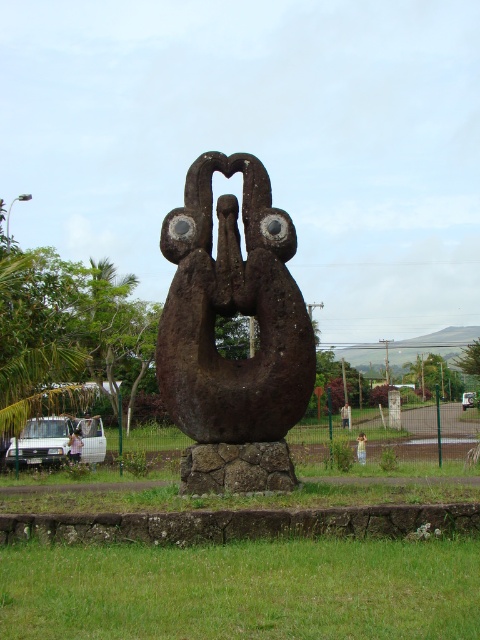
You are standing in front of the stone sculpture and want to place a small object on the ground near the white fabric at lower left. Based on the coordinates provided, where should you aim to place it?

The white fabric at lower left is located at coordinates point (75, 445), so you should aim to place the small object near that coordinate point.